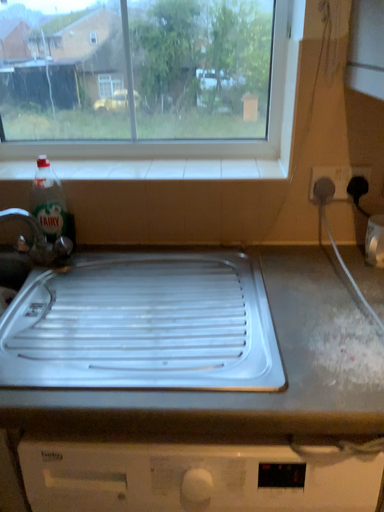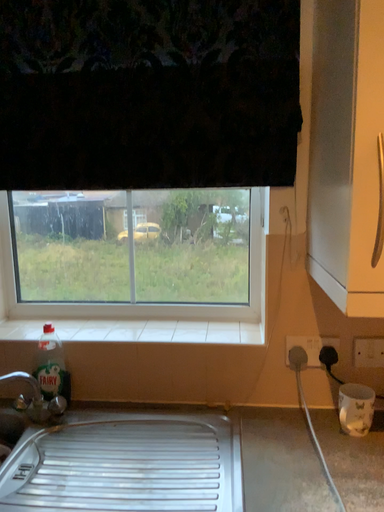
Question: Which way did the camera rotate in the video?

Choices:
 (A) rotated downward
 (B) rotated upward

Answer: (B)